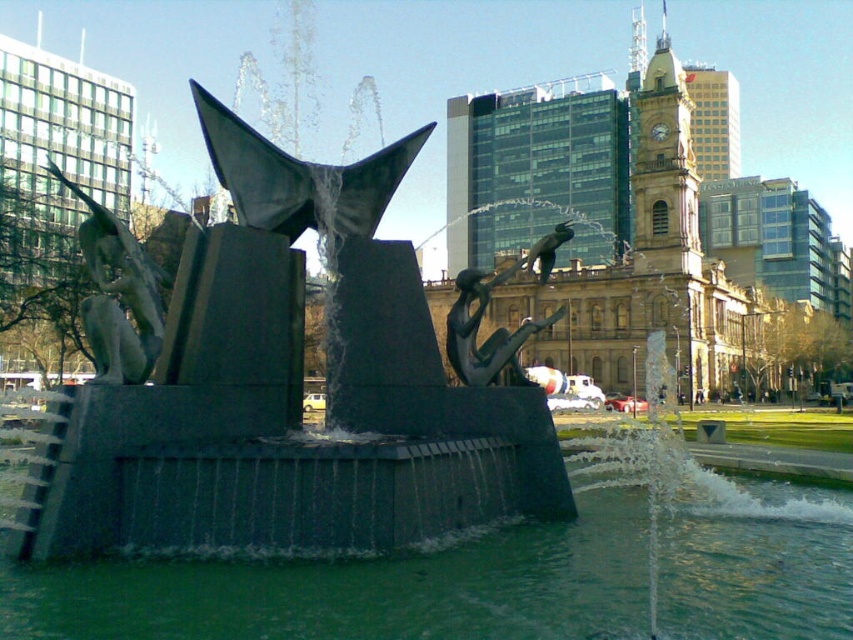
Question: Which object is the closest to the bronze textured figure at center?

Choices:
 (A) green water at fountain center
 (B) polished bronze statue at left

Answer: (A)

Question: Is polished bronze statue at left bigger than bronze textured figure at center?

Choices:
 (A) yes
 (B) no

Answer: (A)

Question: Which point appears farthest from the camera in this image?

Choices:
 (A) (357, 572)
 (B) (532, 253)
 (C) (109, 221)

Answer: (B)

Question: Which object is farther from the camera taking this photo?

Choices:
 (A) green water at fountain center
 (B) polished bronze statue at left
 (C) bronze textured figure at center

Answer: (C)

Question: From the image, what is the correct spatial relationship of green water at fountain center in relation to bronze textured figure at center?

Choices:
 (A) above
 (B) below

Answer: (B)

Question: Can you confirm if green water at fountain center is thinner than bronze textured figure at center?

Choices:
 (A) yes
 (B) no

Answer: (B)